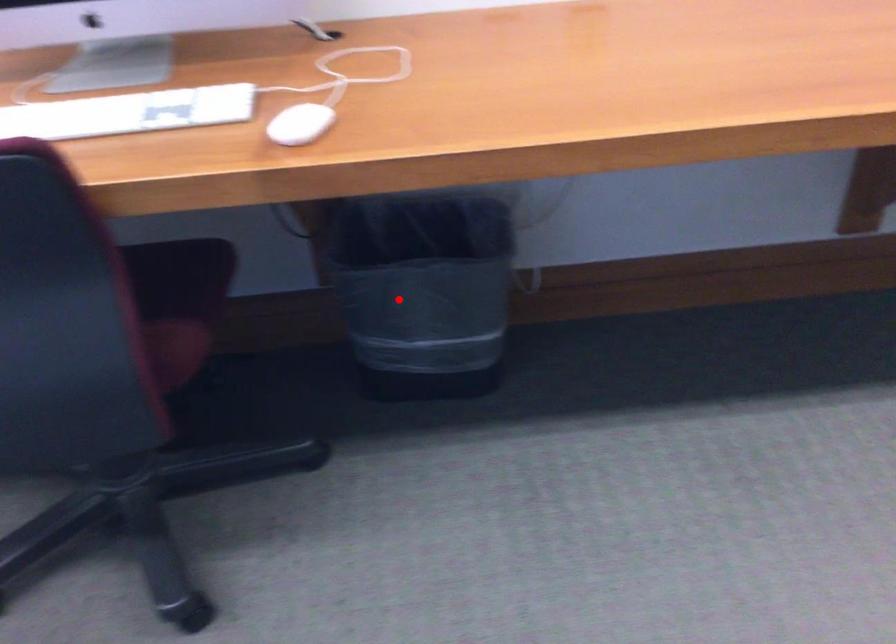
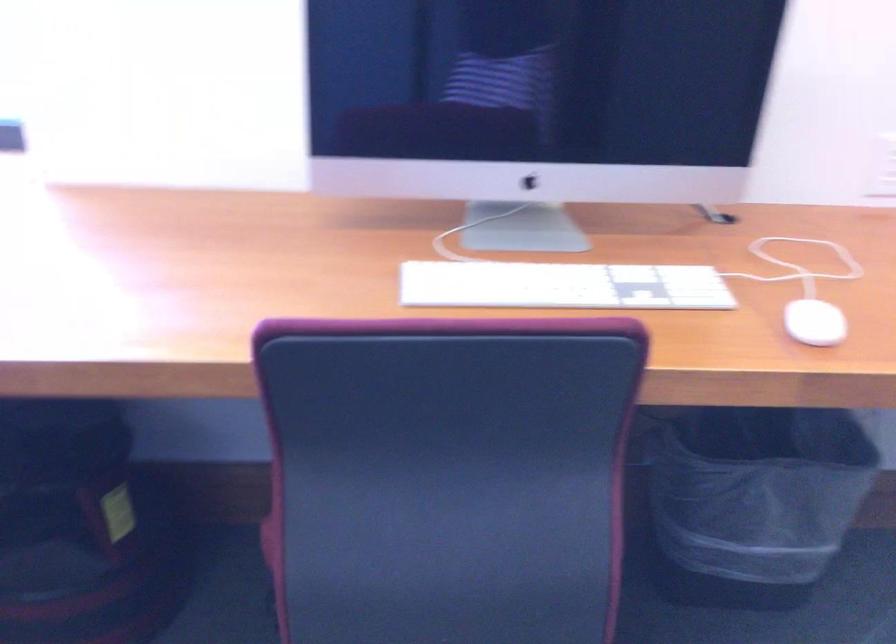
Find the pixel in the second image that matches the highlighted location in the first image.

(753, 500)